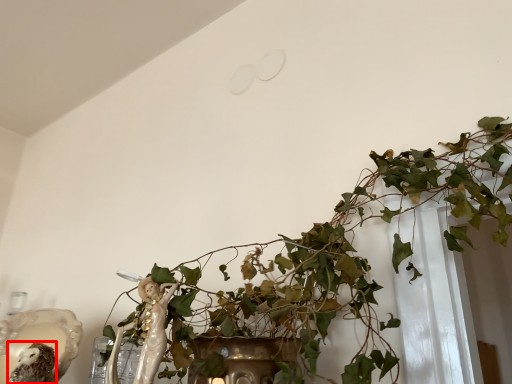
Question: In this image, where is animal (annotated by the red box) located relative to houseplant?

Choices:
 (A) left
 (B) right

Answer: (A)